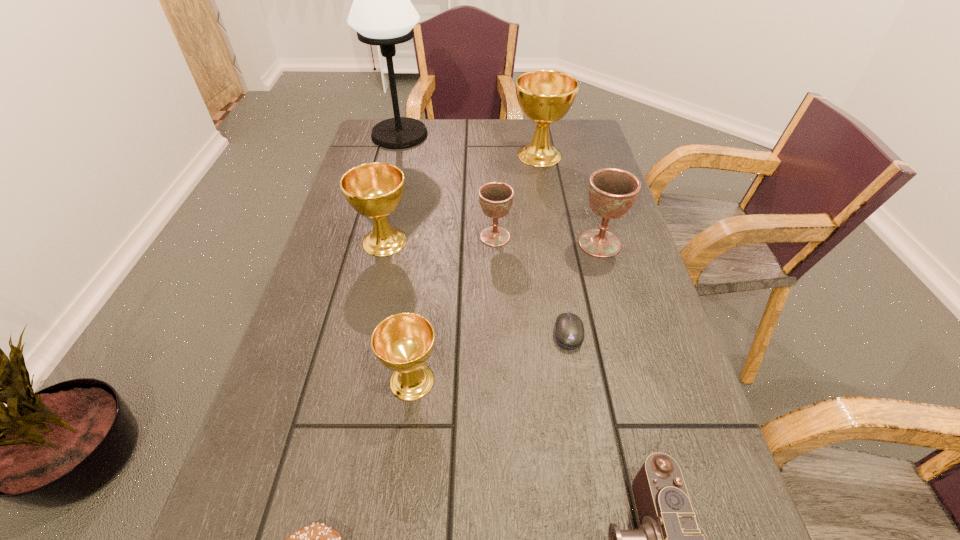
Find the location of a particular element. The width and height of the screenshot is (960, 540). free space that satisfies the following two spatial constraints: 1. on the back side of the left brown chalice; 2. on the right side of the tallest chalice is located at coordinates (492, 155).

Locate an element on the screen. free space that satisfies the following two spatial constraints: 1. on the back side of the biggest gold chalice; 2. on the left side of the third chalice from left to right is located at coordinates (492, 155).

Where is `free location that satisfies the following two spatial constraints: 1. on the back side of the nearest gold chalice; 2. on the left side of the farthest gold chalice`? The height and width of the screenshot is (540, 960). free location that satisfies the following two spatial constraints: 1. on the back side of the nearest gold chalice; 2. on the left side of the farthest gold chalice is located at coordinates (440, 155).